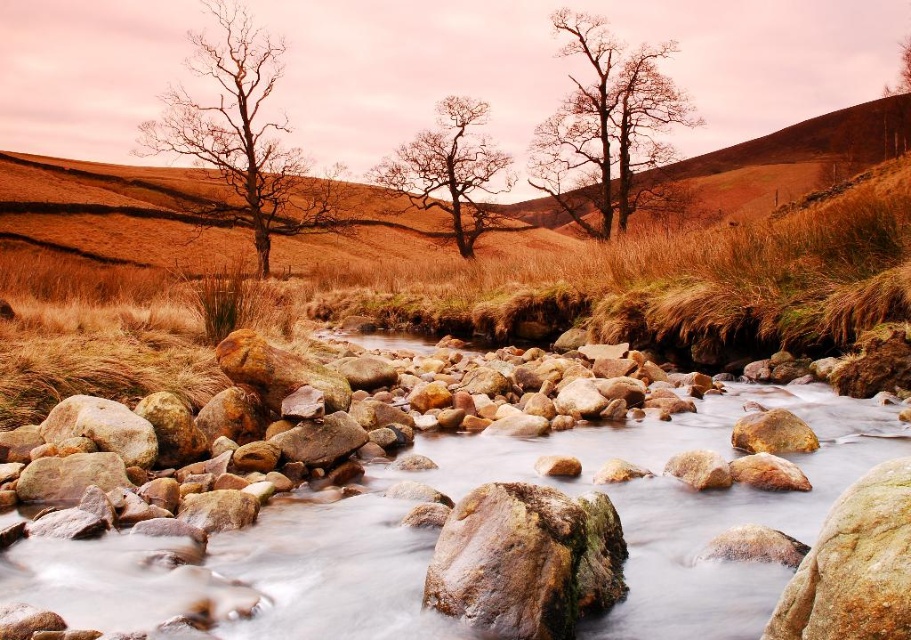
Is brown textured rocks at center smaller than smooth bark tree at center?

Indeed, brown textured rocks at center has a smaller size compared to smooth bark tree at center.

What are the coordinates of `brown textured rocks at center` in the screenshot? It's located at (569, 493).

Between brown textured rocks at center and bare branches at left, which one has more height?

bare branches at left is taller.

Who is shorter, brown textured rocks at center or bare branches at left?

brown textured rocks at center

Identify the location of brown textured rocks at center. This screenshot has width=911, height=640. (569, 493).

At what (x,y) coordinates should I click in order to perform the action: click on brown textured rocks at center. Please return your answer as a coordinate pair (x, y). This screenshot has width=911, height=640. Looking at the image, I should click on click(569, 493).

Can you confirm if bare branches at left is positioned to the left of bare wood tree at upper center?

Indeed, bare branches at left is positioned on the left side of bare wood tree at upper center.

Does bare branches at left appear over bare wood tree at upper center?

Indeed, bare branches at left is positioned over bare wood tree at upper center.

The height and width of the screenshot is (640, 911). What do you see at coordinates (242, 134) in the screenshot?
I see `bare branches at left` at bounding box center [242, 134].

At what (x,y) coordinates should I click in order to perform the action: click on bare branches at left. Please return your answer as a coordinate pair (x, y). This screenshot has height=640, width=911. Looking at the image, I should click on (242, 134).